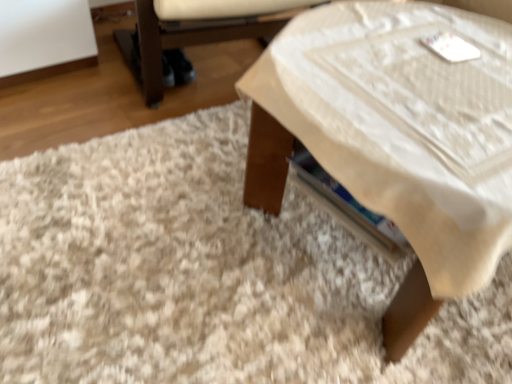
The height and width of the screenshot is (384, 512). What are the coordinates of `free space to the left of wooden table at center` in the screenshot? It's located at pyautogui.click(x=145, y=226).